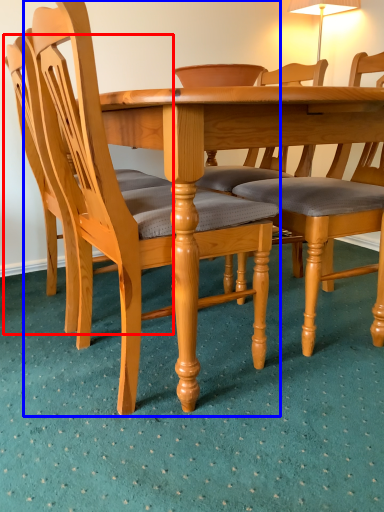
Question: Which of the following is the closest to the observer, chair (highlighted by a red box) or chair (highlighted by a blue box)?

Choices:
 (A) chair
 (B) chair

Answer: (B)